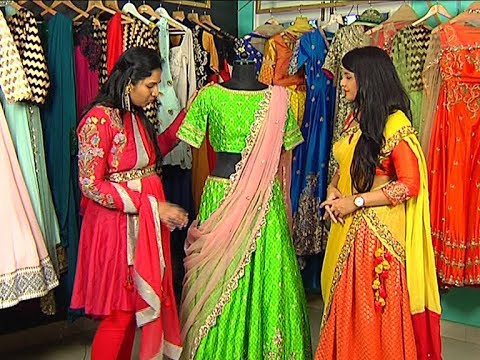
Where is `partial clothing rack`? Image resolution: width=480 pixels, height=360 pixels. partial clothing rack is located at coordinates (290, 10), (188, 4).